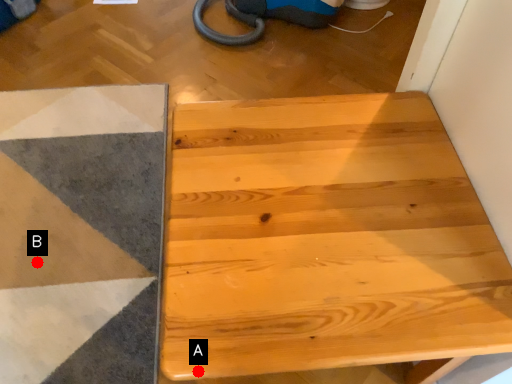
Question: Two points are circled on the image, labeled by A and B beside each circle. Among these points, which one is farthest from the camera?

Choices:
 (A) A is further
 (B) B is further

Answer: (B)